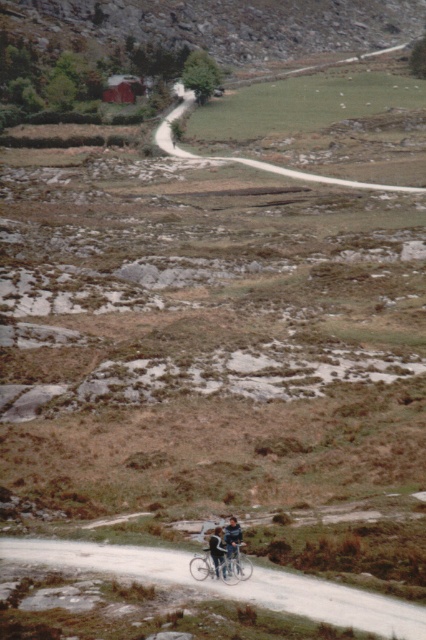
Question: Which point appears farthest from the camera in this image?

Choices:
 (A) (221, 545)
 (B) (359, 628)
 (C) (218, 557)
 (D) (175, 108)

Answer: (D)

Question: Is smooth concrete road at upper center to the left of denim pants at lower center from the viewer's perspective?

Choices:
 (A) yes
 (B) no

Answer: (A)

Question: Considering the real-world distances, which object is farthest from the denim pants at lower center?

Choices:
 (A) smooth gravel path at center
 (B) denim jacket at lower center

Answer: (A)

Question: Does smooth gravel path at center come in front of denim jacket at lower center?

Choices:
 (A) no
 (B) yes

Answer: (B)

Question: Does metallic silver mountain bike at lower center appear on the right side of denim pants at lower center?

Choices:
 (A) yes
 (B) no

Answer: (A)

Question: Estimate the real-world distances between objects in this image. Which object is farther from the metallic silver mountain bike at lower center?

Choices:
 (A) smooth gravel path at center
 (B) smooth concrete road at upper center

Answer: (B)